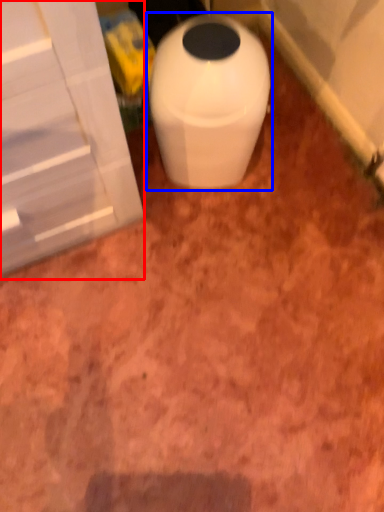
Question: Which object appears farthest to the camera in this image, screen door (highlighted by a red box) or waste container (highlighted by a blue box)?

Choices:
 (A) screen door
 (B) waste container

Answer: (B)